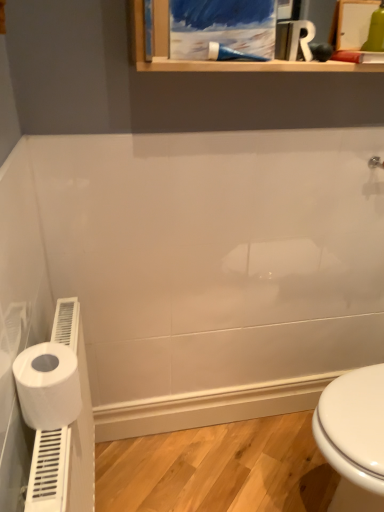
Identify the location of free space above white plastic toilet paper holder at lower left (from a real-world perspective). (72, 354).